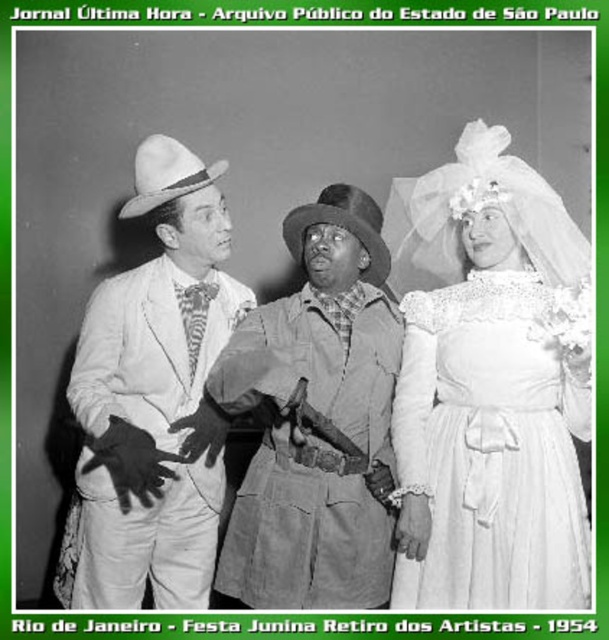
In the image, there are a white lace dress at right and a leather jacket at center. Which object is closer to the bottom edge of the photo?

The white lace dress at right is positioned under the leather jacket at center, so it is closer to the bottom edge of the photo.

You are an event planner arranging a Festa Junina and need to place a decorative banner between the individual on the left and the white lace dress at right. Based on their positions, where should you position the banner?

The banner should be placed between the individual on the left and the white lace dress at right, centered horizontally between them. Since the white lace dress at right is located at point 0.694 on the x and 0.813 on the y, the banner should be positioned midway along the horizontal axis between the left individual and the dress.